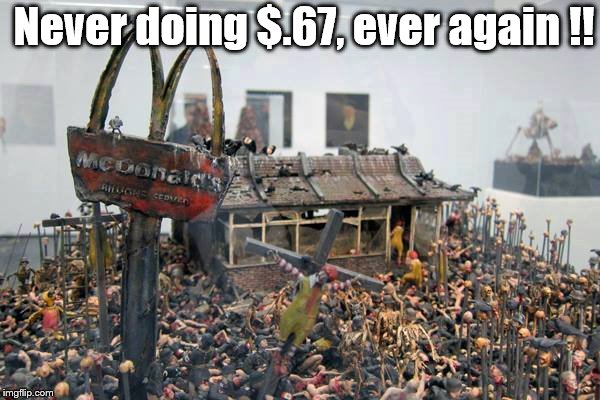
Locate an element on the screen. This screenshot has width=600, height=400. box is located at coordinates (568, 172).